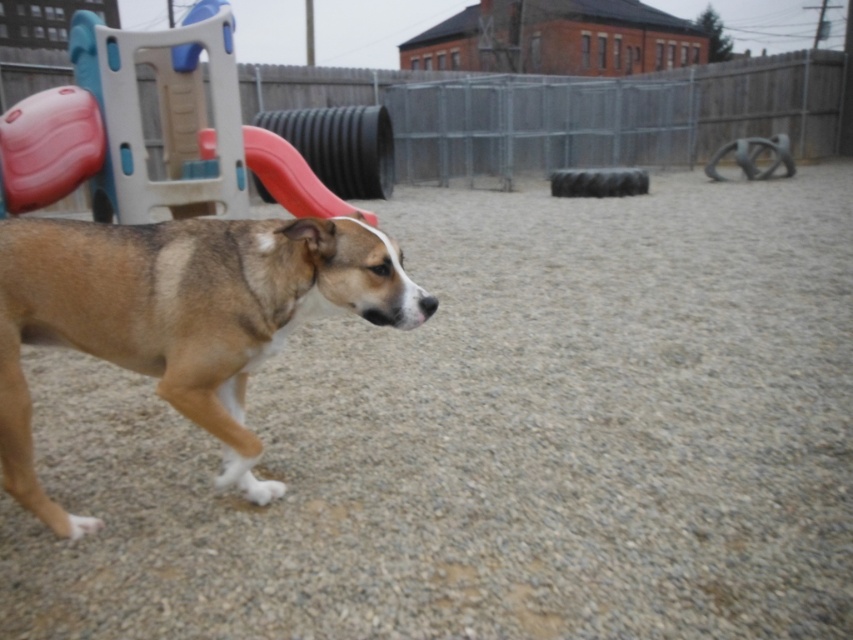
Does point (259, 138) come closer to viewer compared to point (778, 152)?

Yes, point (259, 138) is closer to viewer.

Does rubberized plastic slide at upper left have a greater height compared to rubber tire at center?

No, rubberized plastic slide at upper left is not taller than rubber tire at center.

What do you see at coordinates (291, 177) in the screenshot?
I see `rubberized plastic slide at upper left` at bounding box center [291, 177].

Identify the location of rubberized plastic slide at upper left. (291, 177).

How much distance is there between brown fur dog at center and rubberized plastic slide at upper left?

brown fur dog at center is 2.91 meters from rubberized plastic slide at upper left.

Which is more to the left, brown fur dog at center or rubberized plastic slide at upper left?

rubberized plastic slide at upper left

Does point (117, 339) come behind point (260, 177)?

No, it is not.

Find the location of a particular element. This screenshot has width=853, height=640. brown fur dog at center is located at coordinates (181, 316).

Can you confirm if matte plastic slide at upper left is taller than rubber tire at center?

Yes, matte plastic slide at upper left is taller than rubber tire at center.

Is matte plastic slide at upper left smaller than rubber tire at center?

No, matte plastic slide at upper left is not smaller than rubber tire at center.

Which is in front, point (222, 125) or point (718, 179)?

Point (222, 125) is more forward.

You are a GUI agent. You are given a task and a screenshot of the screen. Output one action in this format:
    pyautogui.click(x=<x>, y=<y>)
    Task: Click on the matte plastic slide at upper left
    
    Given the screenshot: What is the action you would take?
    pyautogui.click(x=73, y=144)